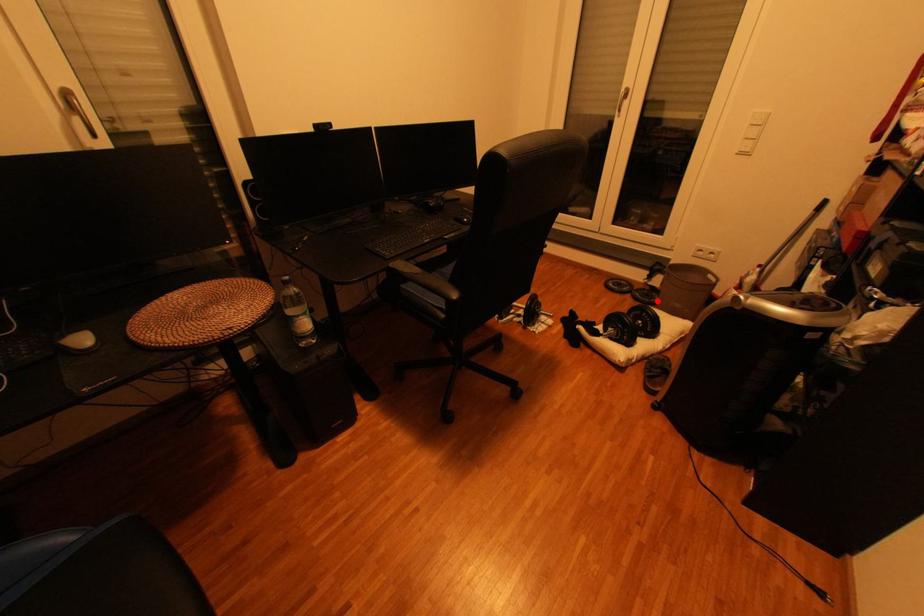
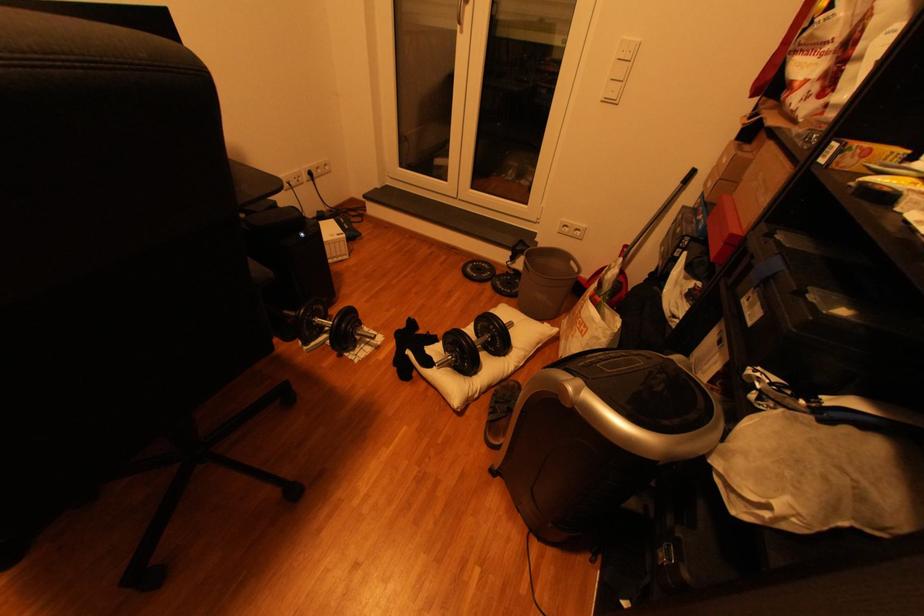
Find the pixel in the second image that matches the highlighted location in the first image.

(518, 292)